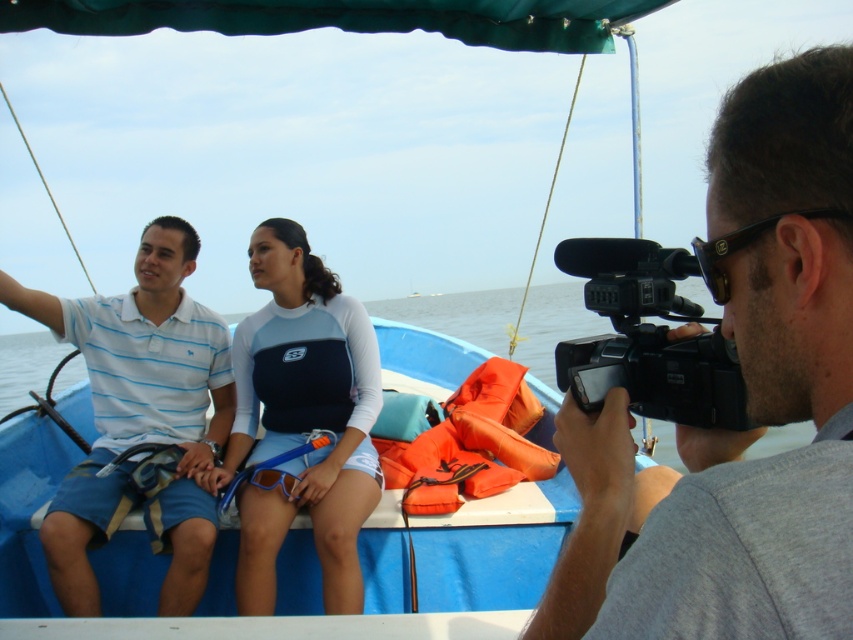
You are a photographer trying to set up two cameras on the edge of a small blue boat. The gray matte camera at right and the black plastic video camera at right need to be placed exactly 5 inches apart. Can you confirm if the current spacing between them meets your requirement?

The distance between the gray matte camera at right and the black plastic video camera at right is 5.01 inches, which is just slightly over the required 5 inches. The spacing is close enough to meet the requirement.

You are a photographer standing on the deck of the boat. You want to take a photo of both the light blue striped polo shirt at left and the black plastic ear at center. Which object should you focus on first to ensure both are in clear view?

The light blue striped polo shirt at left is closer to you than the black plastic ear at center, so focus on the light blue striped polo shirt at left first to ensure both are in clear view.